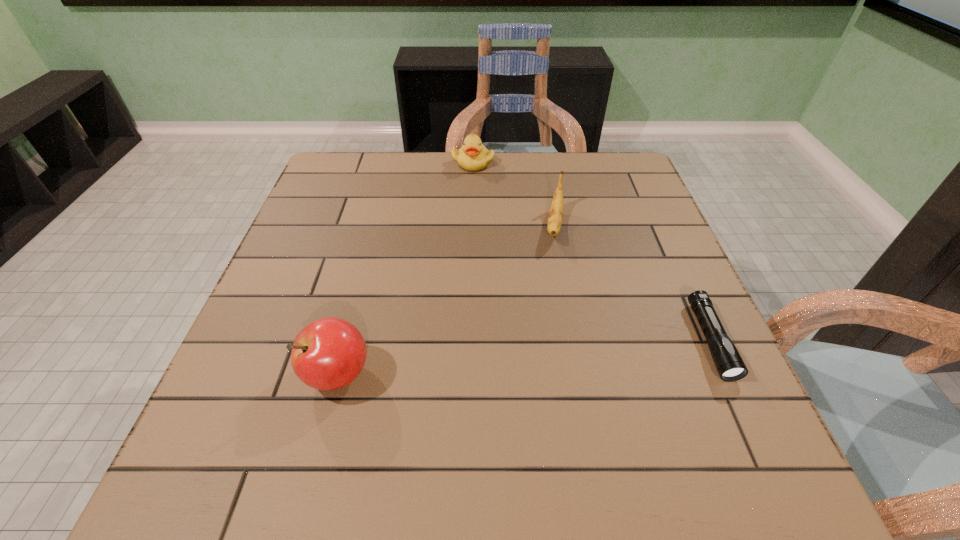
At what (x,y) coordinates should I click in order to perform the action: click on object located in the near left corner section of the desktop. Please return your answer as a coordinate pair (x, y). Image resolution: width=960 pixels, height=540 pixels. Looking at the image, I should click on 329,353.

The width and height of the screenshot is (960, 540). Find the location of `free space at the far edge of the desktop`. free space at the far edge of the desktop is located at coordinates (448, 161).

In order to click on vacant region at the near edge of the desktop in this screenshot , I will do `click(585, 419)`.

Image resolution: width=960 pixels, height=540 pixels. Find the location of `vacant space at the left edge`. vacant space at the left edge is located at coordinates (261, 333).

The height and width of the screenshot is (540, 960). In the image, there is a desktop. In order to click on free space at the right edge in this screenshot , I will do `click(670, 382)`.

Locate an element on the screen. vacant space at the far left corner of the desktop is located at coordinates (324, 185).

In the image, there is a desktop. Identify the location of free space at the near right corner. The width and height of the screenshot is (960, 540). (669, 423).

This screenshot has width=960, height=540. Find the location of `free point between the leftmost object and the rightmost object`. free point between the leftmost object and the rightmost object is located at coordinates (524, 357).

Identify the location of vacant area between the rightmost object and the leftmost object. (524, 357).

Find the location of a particular element. The height and width of the screenshot is (540, 960). free space between the duckling and the rightmost object is located at coordinates (591, 251).